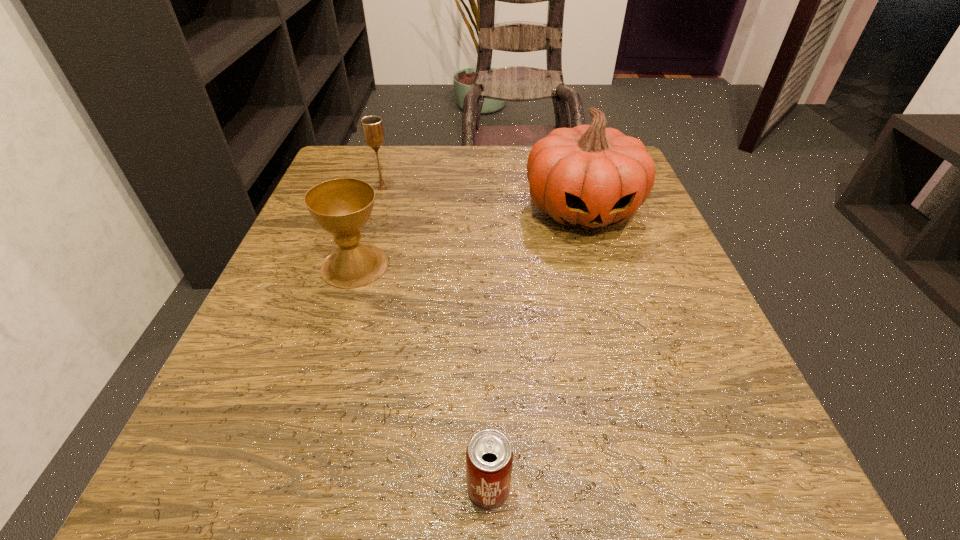
Locate an element on the screen. The image size is (960, 540). pumpkin is located at coordinates (589, 176).

You are a GUI agent. You are given a task and a screenshot of the screen. Output one action in this format:
    pyautogui.click(x=<x>, y=<y>)
    Task: Click on the rightmost object
    The image size is (960, 540).
    Given the screenshot: What is the action you would take?
    pyautogui.click(x=589, y=176)

Find the location of a particular element. The width and height of the screenshot is (960, 540). the farther chalice is located at coordinates (372, 127).

At what (x,y) coordinates should I click in order to perform the action: click on the nearer chalice. Please return your answer as a coordinate pair (x, y). The height and width of the screenshot is (540, 960). Looking at the image, I should click on (342, 207).

The image size is (960, 540). I want to click on the third object from left to right, so click(489, 456).

At what (x,y) coordinates should I click in order to perform the action: click on the shortest object. Please return your answer as a coordinate pair (x, y). The height and width of the screenshot is (540, 960). Looking at the image, I should click on (489, 456).

The height and width of the screenshot is (540, 960). In order to click on free space located on the face of the rightmost object in this screenshot , I will do `click(604, 284)`.

Where is `vacant point located 0.220m on the front of the farther chalice`? Image resolution: width=960 pixels, height=540 pixels. vacant point located 0.220m on the front of the farther chalice is located at coordinates (361, 261).

Find the location of a particular element. The height and width of the screenshot is (540, 960). free space located 0.290m on the back of the nearer chalice is located at coordinates (386, 166).

What are the coordinates of `free space located on the back of the shortest object` in the screenshot? It's located at (487, 345).